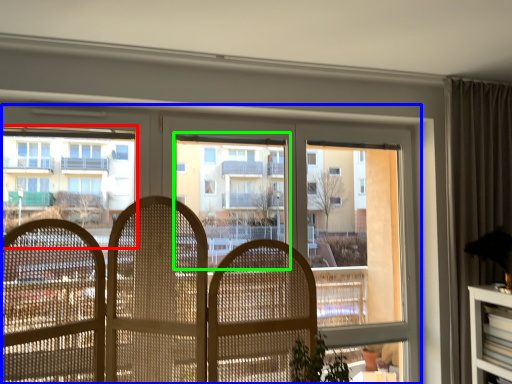
Question: Considering the real-world distances, which object is farthest from condominium (highlighted by a red box)? window (highlighted by a blue box) or bay window (highlighted by a green box)?

Choices:
 (A) window
 (B) bay window

Answer: (B)